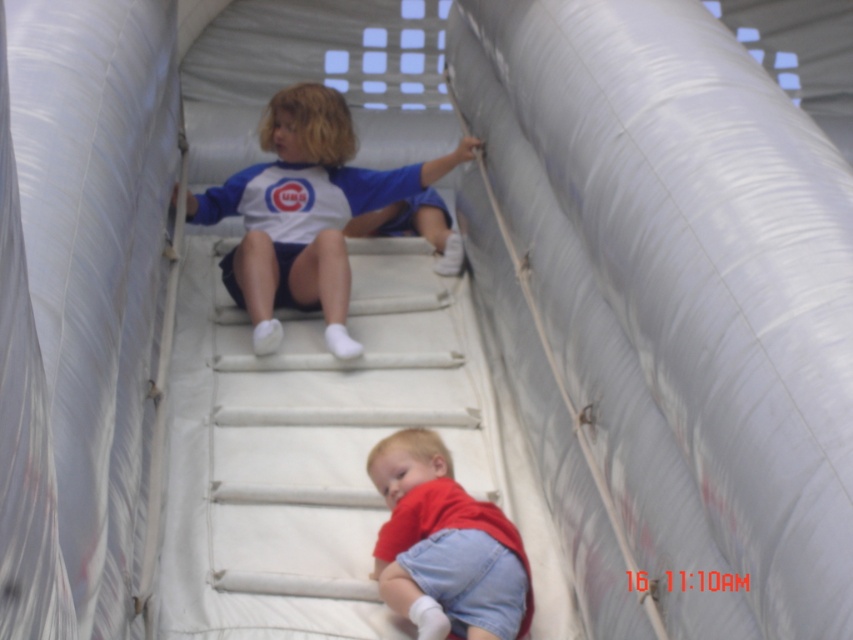
Who is more distant from viewer, (247, 241) or (444, 577)?

The point (247, 241) is more distant.

Can you confirm if blue jersey at center is thinner than red cotton shirt at lower center?

Incorrect, blue jersey at center's width is not less than red cotton shirt at lower center's.

Is point (239, 257) closer to viewer compared to point (421, 458)?

No, (239, 257) is behind (421, 458).

Locate an element on the screen. The height and width of the screenshot is (640, 853). blue jersey at center is located at coordinates (305, 212).